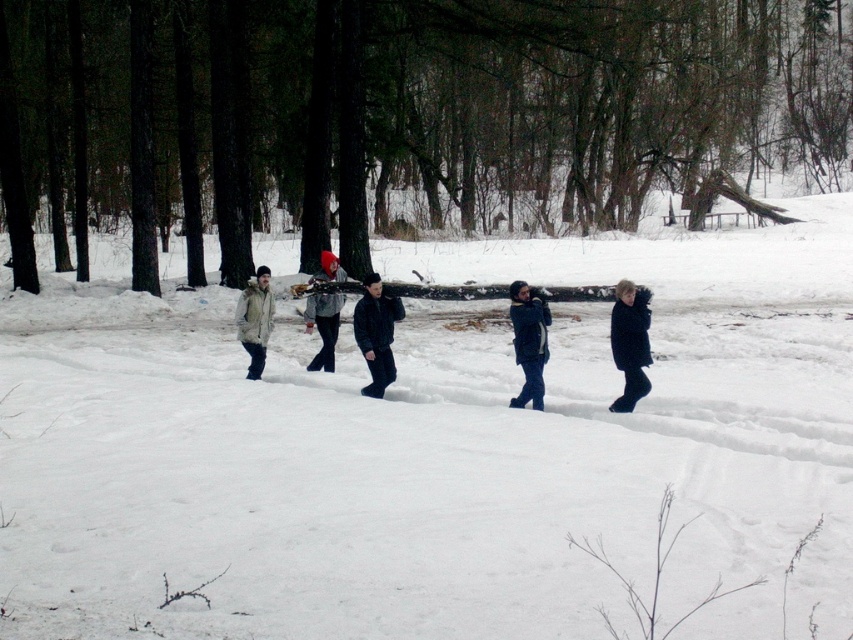
Does dark blue coat at right appear over matte gray jacket at center?

No.

Is dark blue coat at right below matte gray jacket at center?

Correct, dark blue coat at right is located below matte gray jacket at center.

Between point (614, 344) and point (335, 307), which one is positioned behind?

The point (335, 307) is more distant.

Where is `dark blue coat at right`? The image size is (853, 640). dark blue coat at right is located at coordinates (630, 342).

Is white fluffy snow at center to the left of light beige jacket at left from the viewer's perspective?

In fact, white fluffy snow at center is to the right of light beige jacket at left.

Is the position of white fluffy snow at center less distant than that of light beige jacket at left?

Yes, it is.

You are a GUI agent. You are given a task and a screenshot of the screen. Output one action in this format:
    pyautogui.click(x=<x>, y=<y>)
    Task: Click on the white fluffy snow at center
    The width and height of the screenshot is (853, 640).
    Given the screenshot: What is the action you would take?
    pyautogui.click(x=434, y=449)

You are a GUI agent. You are given a task and a screenshot of the screen. Output one action in this format:
    pyautogui.click(x=<x>, y=<y>)
    Task: Click on the white fluffy snow at center
    Image resolution: width=853 pixels, height=640 pixels.
    Given the screenshot: What is the action you would take?
    pyautogui.click(x=434, y=449)

Can you confirm if black matte jacket at center is taller than light beige jacket at left?

Yes, black matte jacket at center is taller than light beige jacket at left.

Is point (392, 333) closer to camera compared to point (263, 332)?

Yes, point (392, 333) is in front of point (263, 332).

Find the location of a particular element. The width and height of the screenshot is (853, 640). black matte jacket at center is located at coordinates (376, 332).